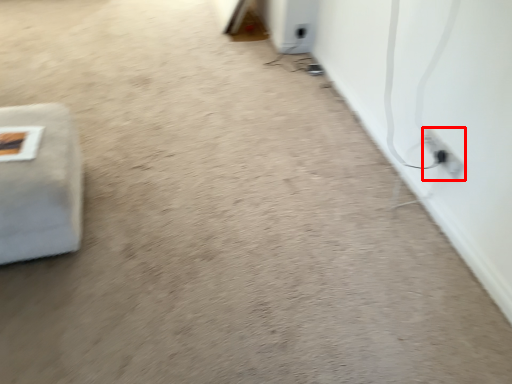
Question: From the image's perspective, considering the relative positions of electric outlet (annotated by the red box) and furniture in the image provided, where is electric outlet (annotated by the red box) located with respect to the staircase?

Choices:
 (A) below
 (B) above

Answer: (B)